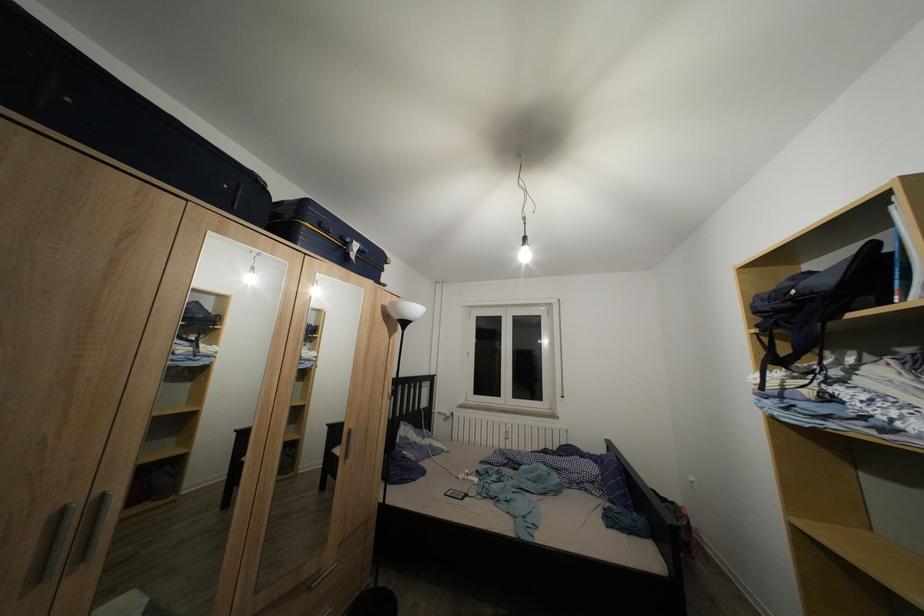
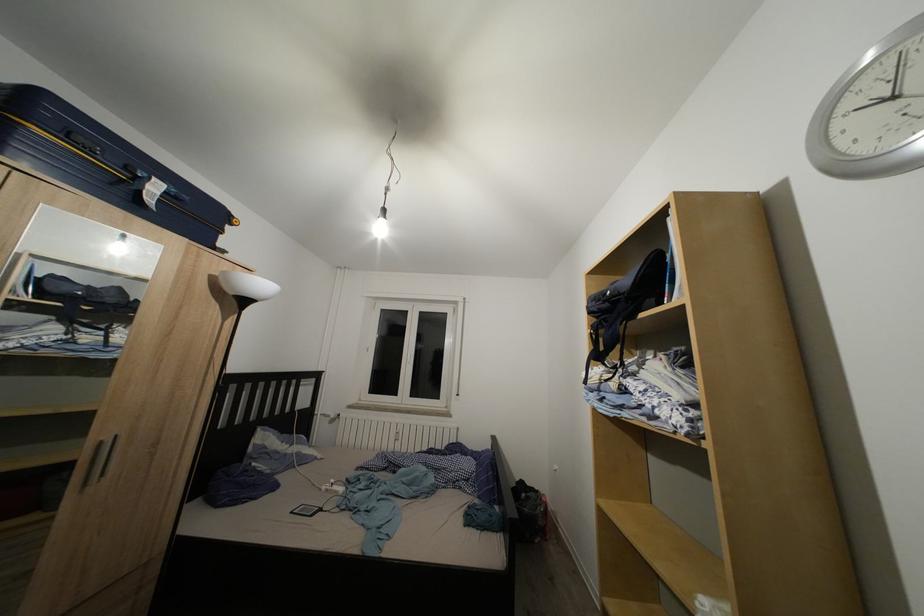
Question: The camera is either moving clockwise (left) or counter-clockwise (right) around the object. The first image is from the beginning of the video and the second image is from the end. Is the camera moving left or right when shooting the video?

Choices:
 (A) Left
 (B) Right

Answer: (A)